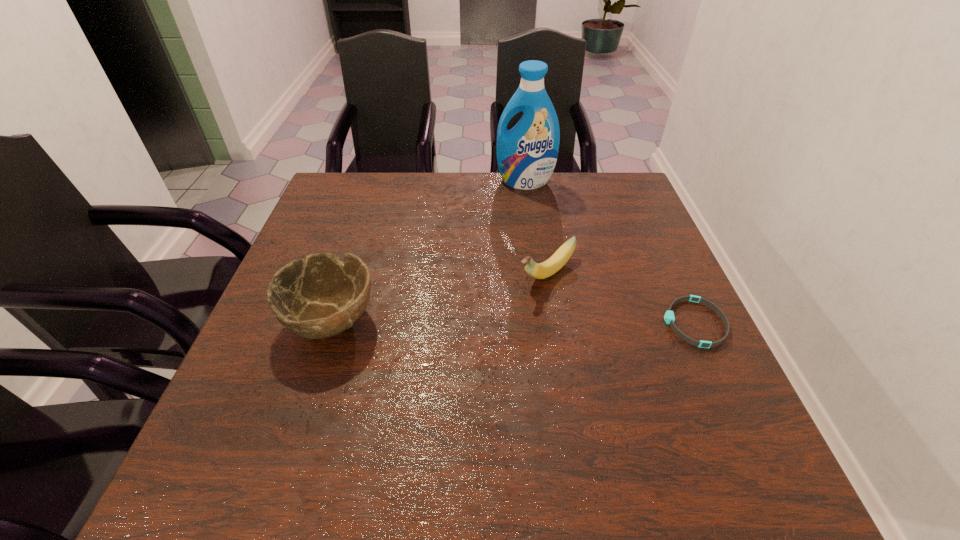
Find the location of a particular element. This screenshot has width=960, height=540. vacant space located 0.360m on the front-facing side of the detergent is located at coordinates (505, 267).

In order to click on vacant space located on the front-facing side of the detergent in this screenshot , I will do `click(509, 249)`.

The width and height of the screenshot is (960, 540). Identify the location of vacant area situated on the front-facing side of the detergent. (511, 240).

Find the location of a particular element. The image size is (960, 540). vacant space located 0.360m at the stem of the banana is located at coordinates (406, 387).

Identify the location of vacant point located 0.190m at the stem of the banana. Image resolution: width=960 pixels, height=540 pixels. (470, 336).

Where is `vacant space located at the stem of the banana`? Image resolution: width=960 pixels, height=540 pixels. vacant space located at the stem of the banana is located at coordinates (419, 377).

At what (x,y) coordinates should I click in order to perform the action: click on object situated at the far edge. Please return your answer as a coordinate pair (x, y). The image size is (960, 540). Looking at the image, I should click on (526, 154).

The width and height of the screenshot is (960, 540). In order to click on object present at the left edge in this screenshot , I will do `click(319, 297)`.

This screenshot has width=960, height=540. I want to click on object at the right edge, so click(x=669, y=317).

The width and height of the screenshot is (960, 540). I want to click on free region at the far edge of the desktop, so click(535, 193).